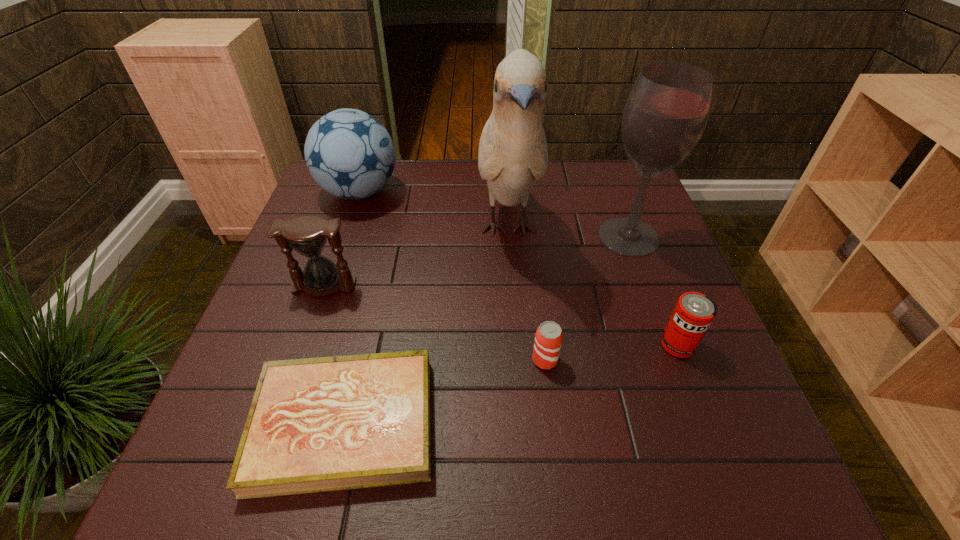
Find the location of a particular element. The height and width of the screenshot is (540, 960). alcohol that is at the right edge is located at coordinates (667, 111).

At what (x,y) coordinates should I click in order to perform the action: click on can located at the right edge. Please return your answer as a coordinate pair (x, y). Image resolution: width=960 pixels, height=540 pixels. Looking at the image, I should click on (694, 312).

Identify the location of object located in the far left corner section of the desktop. Image resolution: width=960 pixels, height=540 pixels. (349, 153).

You are a GUI agent. You are given a task and a screenshot of the screen. Output one action in this format:
    pyautogui.click(x=<x>, y=<y>)
    Task: Click on the object present at the near left corner
    This screenshot has width=960, height=540.
    Given the screenshot: What is the action you would take?
    pyautogui.click(x=321, y=424)

Where is `vacant position at the far edge of the desktop`? vacant position at the far edge of the desktop is located at coordinates (569, 198).

This screenshot has height=540, width=960. I want to click on free space at the near edge of the desktop, so click(458, 474).

You are a GUI agent. You are given a task and a screenshot of the screen. Output one action in this format:
    pyautogui.click(x=<x>, y=<y>)
    Task: Click on the vacant space at the left edge of the desktop
    Image resolution: width=960 pixels, height=540 pixels.
    Given the screenshot: What is the action you would take?
    pyautogui.click(x=331, y=257)

Image resolution: width=960 pixels, height=540 pixels. Find the location of `vacant region at the right edge of the desktop`. vacant region at the right edge of the desktop is located at coordinates (643, 341).

Locate an element on the screen. The width and height of the screenshot is (960, 540). free space at the far left corner is located at coordinates (335, 203).

Where is `vacant space at the far right corner`? vacant space at the far right corner is located at coordinates (612, 159).